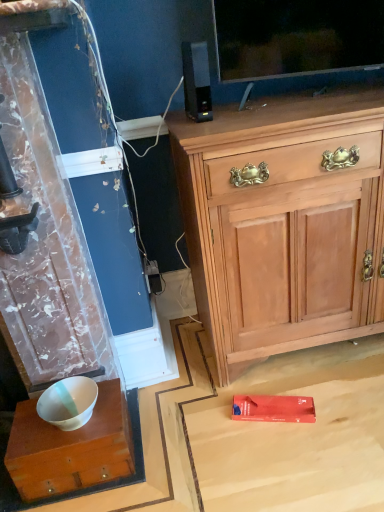
Question: In terms of height, does white glossy wood desk at lower left look taller or shorter compared to black plastic speaker at upper center?

Choices:
 (A) short
 (B) tall

Answer: (A)

Question: Based on their sizes in the image, would you say white glossy wood desk at lower left is bigger or smaller than black plastic speaker at upper center?

Choices:
 (A) big
 (B) small

Answer: (A)

Question: Based on their relative distances, which object is farther from the white glossy wood desk at lower left?

Choices:
 (A) black plastic speaker at upper center
 (B) light wood cabinet at upper right

Answer: (A)

Question: Which of these objects is positioned farthest from the white glossy wood desk at lower left?

Choices:
 (A) black plastic speaker at upper center
 (B) light wood cabinet at upper right

Answer: (A)